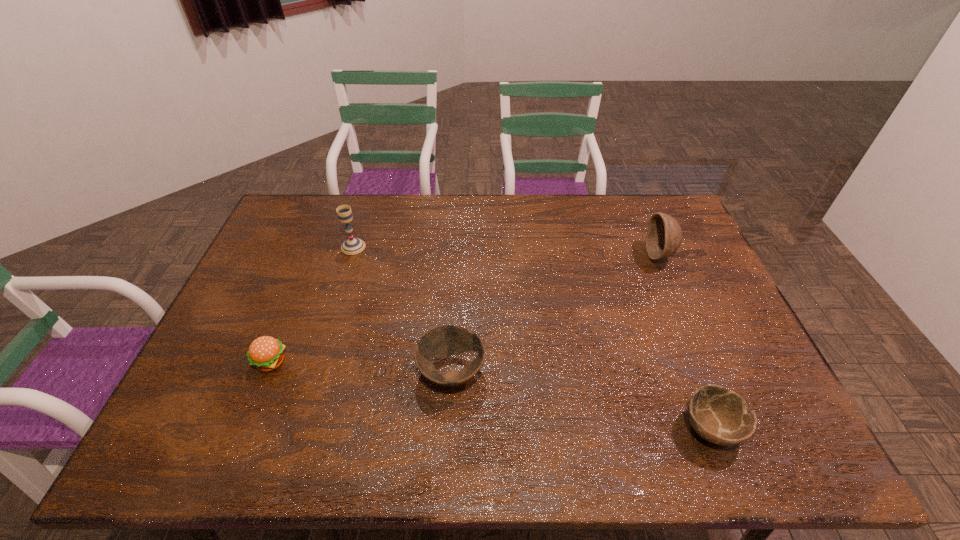
Find the location of a particular element. object present at the near edge is located at coordinates (720, 416).

Identify the location of object present at the left edge. The height and width of the screenshot is (540, 960). (266, 353).

The width and height of the screenshot is (960, 540). In order to click on object located at the near right corner in this screenshot , I will do `click(720, 416)`.

Find the location of a particular element. This screenshot has width=960, height=540. free space at the far edge is located at coordinates (597, 214).

Identify the location of vacant region at the near edge of the desktop. The height and width of the screenshot is (540, 960). (307, 431).

This screenshot has width=960, height=540. Identify the location of free space at the left edge. (259, 257).

Where is `free space at the far left corner of the desktop`? This screenshot has height=540, width=960. free space at the far left corner of the desktop is located at coordinates (316, 219).

Where is `free space at the near left corner of the desktop`? free space at the near left corner of the desktop is located at coordinates (154, 465).

Locate an element on the screen. unoccupied position between the tallest bowl and the chalice is located at coordinates (506, 251).

This screenshot has height=540, width=960. I want to click on vacant region between the fourth object from right to left and the hamburger, so click(312, 304).